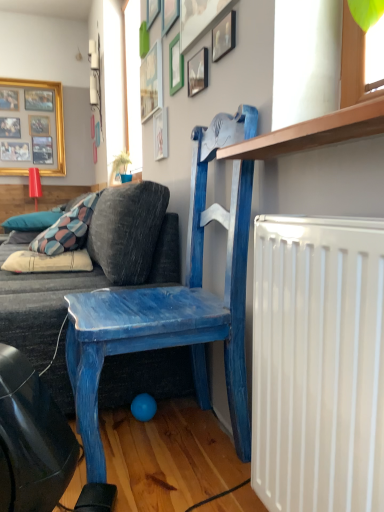
Question: Can you confirm if dark gray fabric couch at left is thinner than blue painted wood chair at upper center?

Choices:
 (A) no
 (B) yes

Answer: (A)

Question: Is dark gray fabric couch at left completely or partially outside of blue painted wood chair at upper center?

Choices:
 (A) yes
 (B) no

Answer: (A)

Question: Is dark gray fabric couch at left positioned far away from blue painted wood chair at upper center?

Choices:
 (A) no
 (B) yes

Answer: (A)

Question: Is dark gray fabric couch at left shorter than blue painted wood chair at upper center?

Choices:
 (A) no
 (B) yes

Answer: (B)

Question: Considering the relative sizes of dark gray fabric couch at left and blue painted wood chair at upper center in the image provided, is dark gray fabric couch at left taller than blue painted wood chair at upper center?

Choices:
 (A) yes
 (B) no

Answer: (B)

Question: Is dark gray fabric couch at left closer to camera compared to blue painted wood chair at upper center?

Choices:
 (A) yes
 (B) no

Answer: (B)

Question: Are white cotton pillow at lower left, the first pillow positioned from the bottom, and wooden picture frame at upper center, placed as the 4th picture frame when sorted from back to front, far apart?

Choices:
 (A) no
 (B) yes

Answer: (B)

Question: From the image's perspective, does white cotton pillow at lower left, the 2th pillow from the top, appear lower than wooden picture frame at upper center, the 5th picture frame when ordered from front to back?

Choices:
 (A) no
 (B) yes

Answer: (B)

Question: From a real-world perspective, does white cotton pillow at lower left, the first pillow positioned from the bottom, stand above wooden picture frame at upper center, the 6th picture frame positioned from the right?

Choices:
 (A) yes
 (B) no

Answer: (B)

Question: Can you confirm if white cotton pillow at lower left, the 2th pillow from the top, is smaller than wooden picture frame at upper center, the 6th picture frame positioned from the right?

Choices:
 (A) yes
 (B) no

Answer: (B)

Question: From a real-world perspective, does white cotton pillow at lower left, acting as the 1th pillow starting from the right, sit lower than wooden picture frame at upper center, the 6th picture frame positioned from the right?

Choices:
 (A) no
 (B) yes

Answer: (B)

Question: Is white cotton pillow at lower left, the 2th pillow from the top, closer to camera compared to wooden picture frame at upper center, placed as the 4th picture frame when sorted from back to front?

Choices:
 (A) yes
 (B) no

Answer: (B)

Question: Does blue painted wood chair at upper center have a greater width compared to wooden picture frame at upper center, the 5th picture frame when ordered from front to back?

Choices:
 (A) no
 (B) yes

Answer: (B)